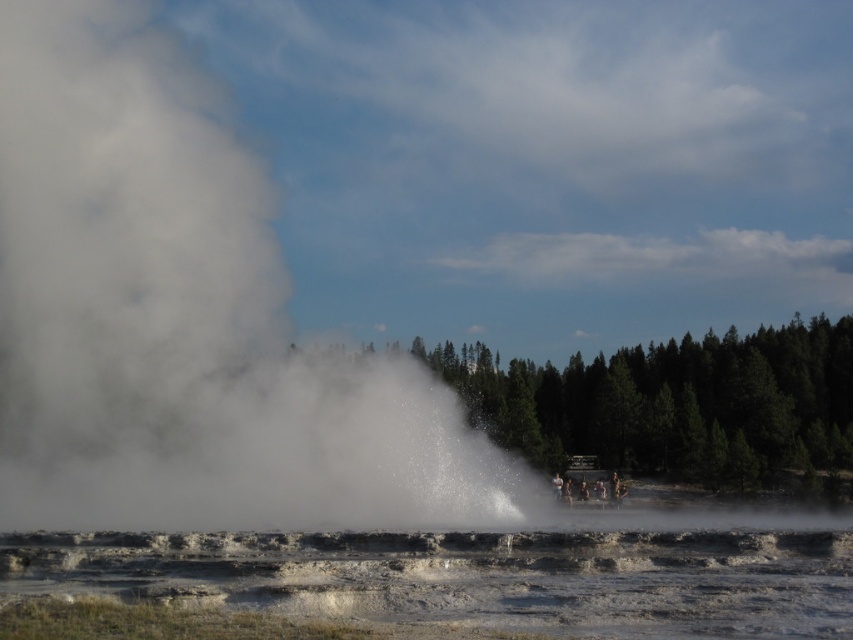
You are a park ranger guiding visitors to the geyser field. You notice the white vapor at center and the white frothy water at center. Which one is higher in elevation?

The white vapor at center is above white frothy water at center, so the white vapor at center is higher in elevation.

Based on the scene description, which object, the white vapor at center or the white frothy water at center, is wider?

The white vapor at center might be wider than white frothy water at center.